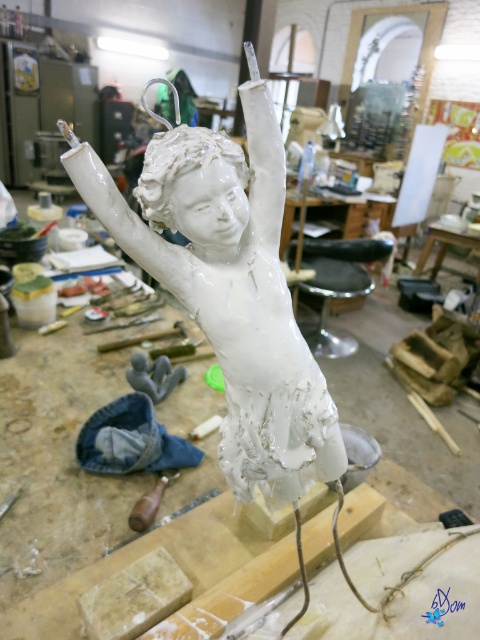
Looking at this image, who is more distant from viewer, (171, 227) or (139, 516)?

Point (139, 516)

Which of these two, white glossy statue at center or wooden handle at center, stands shorter?

Standing shorter between the two is wooden handle at center.

Is point (184, 168) less distant than point (132, 512)?

Yes, it is in front of point (132, 512).

At what (x,y) coordinates should I click in order to perform the action: click on white glossy statue at center. Please return your answer as a coordinate pair (x, y). The image size is (480, 640). Looking at the image, I should click on (228, 284).